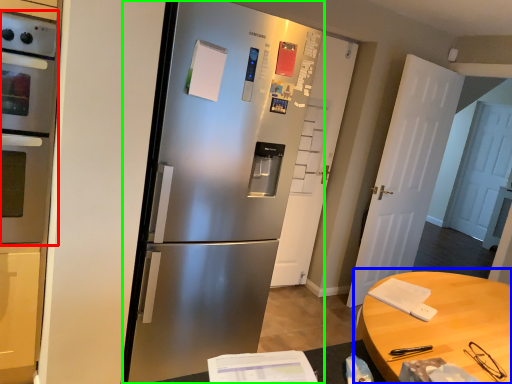
Question: Which is nearer to the oven (highlighted by a red box)? table (highlighted by a blue box) or refrigerator (highlighted by a green box).

Choices:
 (A) table
 (B) refrigerator

Answer: (B)